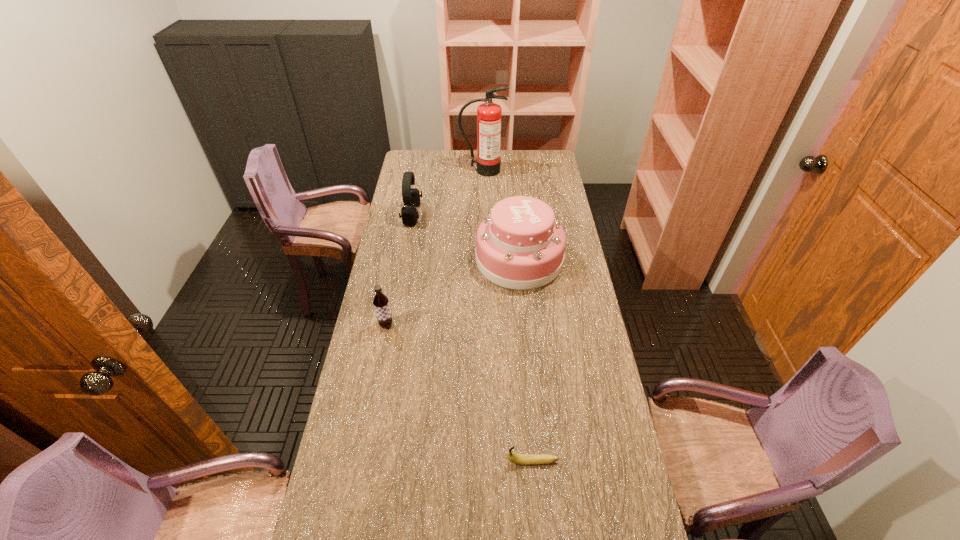
Identify the location of the farthest object. (489, 115).

Locate an element on the screen. Image resolution: width=960 pixels, height=540 pixels. the tallest object is located at coordinates (489, 115).

Locate an element on the screen. the third farthest object is located at coordinates click(520, 246).

Where is `the fourth nearest object`? This screenshot has height=540, width=960. the fourth nearest object is located at coordinates (411, 196).

Locate an element on the screen. the second nearest object is located at coordinates (381, 302).

Find the location of a particular element. The height and width of the screenshot is (540, 960). the nearest object is located at coordinates (522, 459).

Locate an element on the screen. The width and height of the screenshot is (960, 540). the shortest object is located at coordinates (522, 459).

Locate an element on the screen. free space located 0.090m on the front-facing side of the farthest object is located at coordinates (483, 187).

The width and height of the screenshot is (960, 540). I want to click on vacant space located on the back of the cake, so click(513, 185).

The width and height of the screenshot is (960, 540). In order to click on free location located 0.110m on the headband of the headset in this screenshot , I will do `click(445, 214)`.